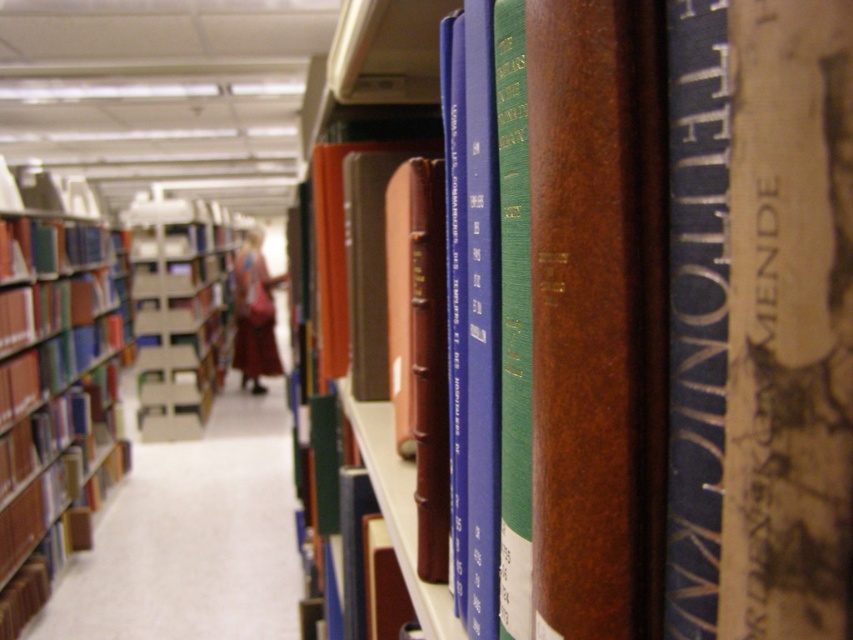
What do you see at coordinates (646, 307) in the screenshot?
I see `brown leather book at center` at bounding box center [646, 307].

Which is more to the right, brown leather book at center or brown leather bookcase at left?

From the viewer's perspective, brown leather book at center appears more on the right side.

The height and width of the screenshot is (640, 853). In order to click on brown leather book at center in this screenshot , I will do `click(646, 307)`.

Is brown leather book at center shorter than matte cardboard bookcase at center?

Yes.

Which is in front, point (798, 428) or point (141, 340)?

Point (798, 428)

Find the location of a particular element. The width and height of the screenshot is (853, 640). brown leather book at center is located at coordinates (646, 307).

Can you confirm if brown leather bookcase at left is wider than matte cardboard bookcase at center?

Yes.

Identify the location of brown leather bookcase at left. (55, 381).